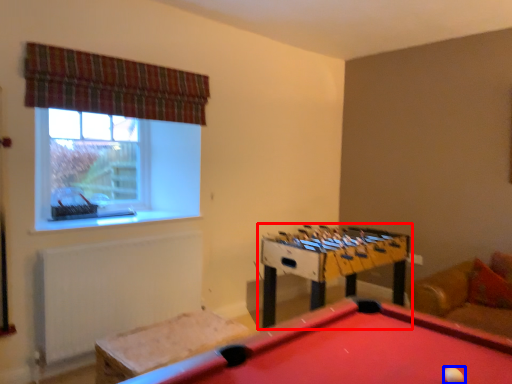
Question: Which object appears farthest to the camera in this image, table (highlighted by a red box) or ball (highlighted by a blue box)?

Choices:
 (A) table
 (B) ball

Answer: (A)